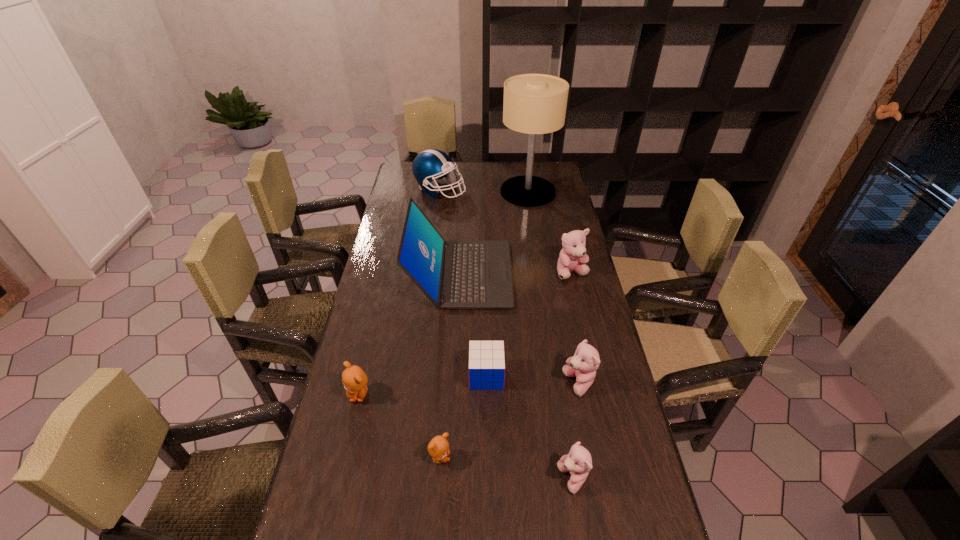
Identify the location of table lamp. (534, 104).

This screenshot has height=540, width=960. What are the coordinates of `the tallest object` in the screenshot? It's located at (534, 104).

Where is `gray laptop computer`? gray laptop computer is located at coordinates (456, 274).

What are the coordinates of `football helmet` in the screenshot? It's located at (430, 165).

Identify the location of the farthest teddy bear. Image resolution: width=960 pixels, height=540 pixels. (572, 258).

The width and height of the screenshot is (960, 540). Identify the location of the tallest teddy bear. (572, 258).

Find the location of a particular element. Image resolution: width=960 pixels, height=540 pixels. the second farthest pink teddy bear is located at coordinates (583, 365).

At what (x,y) coordinates should I click in order to perform the action: click on the second biggest pink teddy bear. Please return your answer as a coordinate pair (x, y). Looking at the image, I should click on (583, 365).

At what (x,y) coordinates should I click in order to perform the action: click on the left brown teddy bear. Please return your answer as a coordinate pair (x, y). Looking at the image, I should click on (x=354, y=379).

The width and height of the screenshot is (960, 540). What are the coordinates of `the farther brown teddy bear` in the screenshot? It's located at (354, 379).